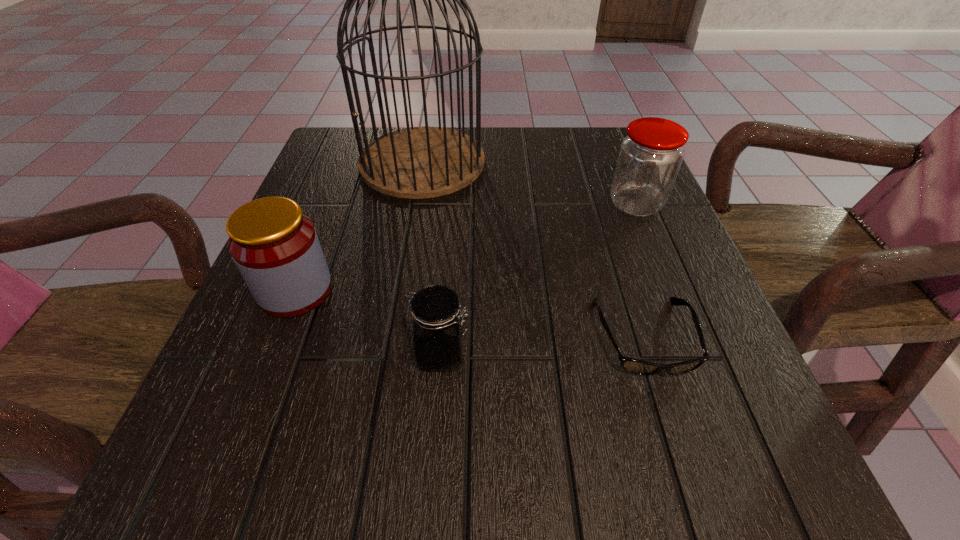
Locate an element on the screen. This screenshot has width=960, height=540. vacant space at the far left corner is located at coordinates (342, 145).

Where is `blank space at the far right corner of the desktop`? This screenshot has width=960, height=540. blank space at the far right corner of the desktop is located at coordinates (617, 139).

The height and width of the screenshot is (540, 960). Identify the location of free space at the near right corner. (723, 449).

Where is `free point between the second farthest jar and the shortest object`? The image size is (960, 540). free point between the second farthest jar and the shortest object is located at coordinates (469, 314).

Locate an element on the screen. free space between the nearest jar and the birdcage is located at coordinates (432, 258).

Where is `free point between the shortest object and the birdcage`? free point between the shortest object and the birdcage is located at coordinates (534, 249).

I want to click on vacant space that is in between the rightmost jar and the second farthest jar, so click(x=466, y=247).

Locate an element on the screen. The height and width of the screenshot is (540, 960). free spot between the tallest object and the spectacles is located at coordinates (534, 249).

At what (x,y) coordinates should I click in order to perform the action: click on free space between the shortest object and the birdcage. Please return your answer as a coordinate pair (x, y). The width and height of the screenshot is (960, 540). Looking at the image, I should click on click(534, 249).

Locate an element on the screen. The height and width of the screenshot is (540, 960). vacant region between the spectacles and the second jar from right to left is located at coordinates (542, 346).